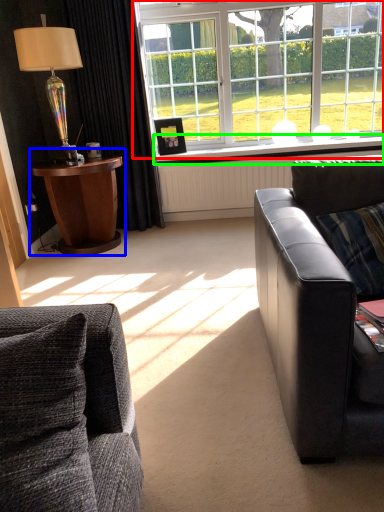
Question: Which object is positioned farthest from window (highlighted by a red box)? Select from table (highlighted by a blue box) and window sill (highlighted by a green box).

Choices:
 (A) table
 (B) window sill

Answer: (B)